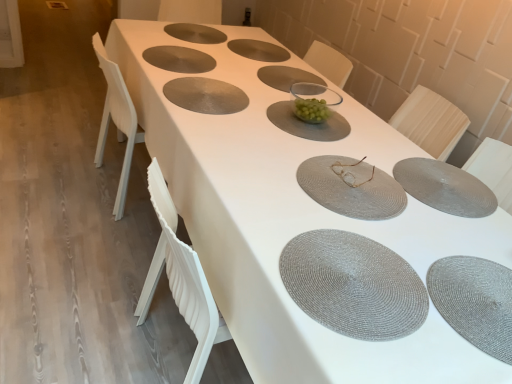
You are a GUI agent. You are given a task and a screenshot of the screen. Output one action in this format:
    pyautogui.click(x=<x>, y=<y>)
    Task: Click on the free space in front of green glass bowl at center, arranged as the 5th tableware when ordered from the bottom
    The height and width of the screenshot is (384, 512).
    Given the screenshot: What is the action you would take?
    pyautogui.click(x=288, y=144)